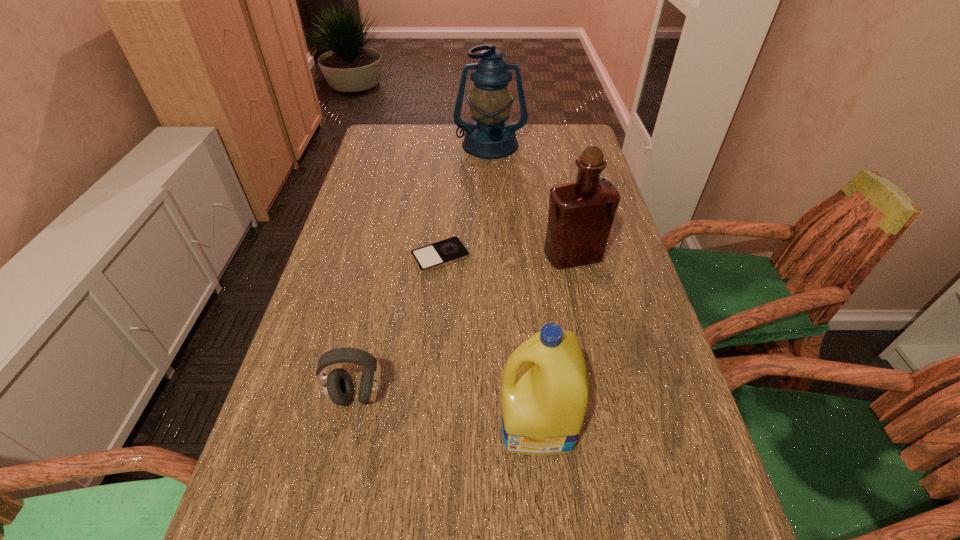
Locate an element on the screen. The height and width of the screenshot is (540, 960). blank region between the iPod and the liquor is located at coordinates (507, 256).

The image size is (960, 540). What are the coordinates of `vacant area between the liquor and the leftmost object` in the screenshot? It's located at (465, 326).

This screenshot has width=960, height=540. In order to click on free spot between the liquor and the iPod in this screenshot , I will do `click(507, 256)`.

Find the location of a particular element. The image size is (960, 540). free area in between the iPod and the detergent is located at coordinates (489, 339).

At what (x,y) coordinates should I click in order to perform the action: click on vacant area that lies between the lantern and the shortest object. Please return your answer as a coordinate pair (x, y). This screenshot has height=540, width=960. Looking at the image, I should click on point(466,200).

You are a GUI agent. You are given a task and a screenshot of the screen. Output one action in this format:
    pyautogui.click(x=<x>, y=<y>)
    Task: Click on the free space between the liquor and the farthest object
    The width and height of the screenshot is (960, 540).
    Given the screenshot: What is the action you would take?
    pyautogui.click(x=532, y=200)

Locate an element on the screen. The width and height of the screenshot is (960, 540). free space between the shortest object and the lantern is located at coordinates (466, 200).

This screenshot has height=540, width=960. Identify the location of free spot between the liquor and the shortest object. (507, 256).

The height and width of the screenshot is (540, 960). What are the coordinates of `free space that is in between the lantern and the liquor` in the screenshot? It's located at (532, 200).

Where is `unoccupied position between the detergent and the leftmost object`? The image size is (960, 540). unoccupied position between the detergent and the leftmost object is located at coordinates (446, 409).